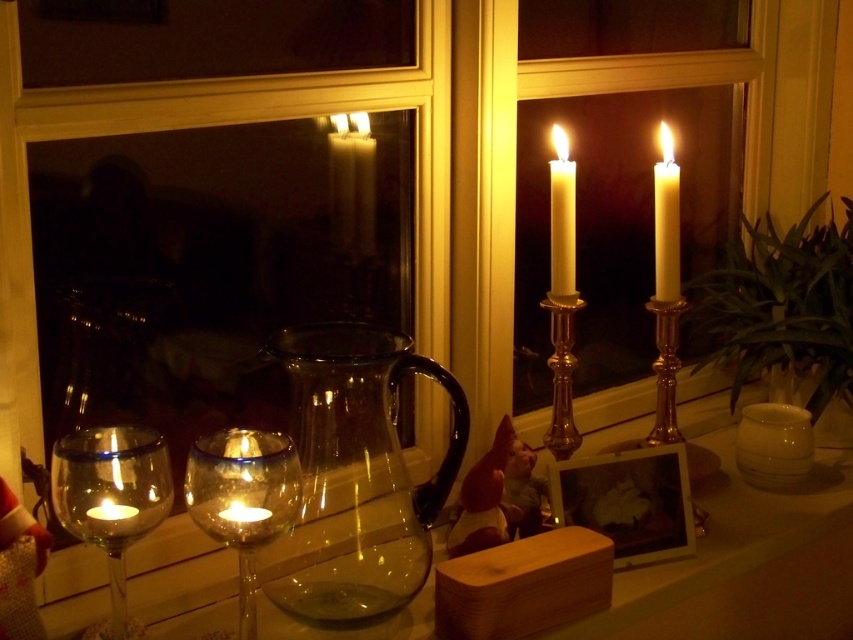
Question: Can you confirm if white wax candle at upper right is smaller than white wax candle at right?

Choices:
 (A) yes
 (B) no

Answer: (B)

Question: Where is white glossy candle holder at lower right located in relation to white wax candle at upper right in the image?

Choices:
 (A) left
 (B) right

Answer: (B)

Question: Which of the following is the closest to the observer?

Choices:
 (A) (25, 202)
 (B) (782, 440)

Answer: (A)

Question: Which object appears closest to the camera in this image?

Choices:
 (A) transparent glass window at center
 (B) translucent glass candle at lower left
 (C) white wax candle at upper left

Answer: (B)

Question: Can you confirm if translucent glass candle at lower left is smaller than white wax candle at upper left?

Choices:
 (A) yes
 (B) no

Answer: (B)

Question: Which point is closer to the camera taking this photo?

Choices:
 (A) (225, 97)
 (B) (65, 520)

Answer: (B)